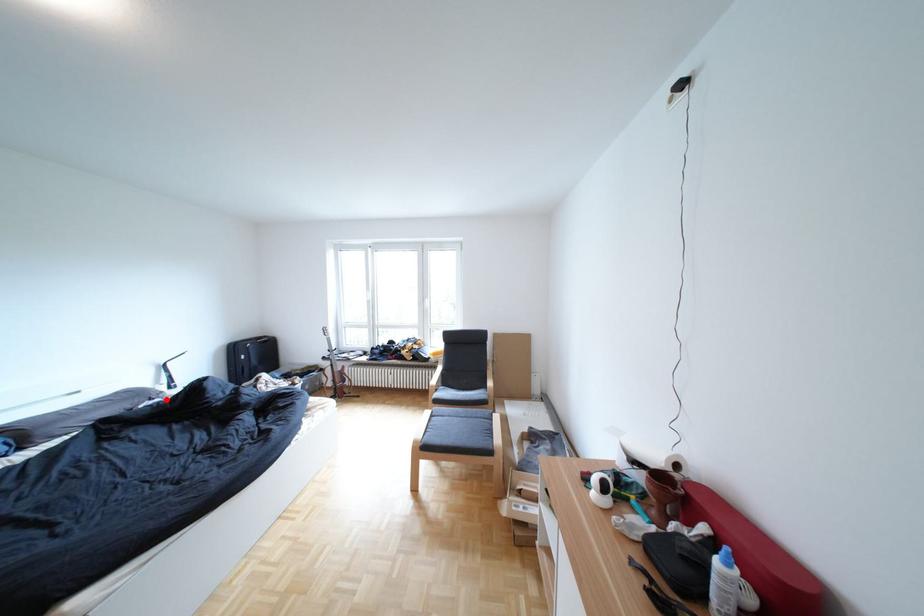
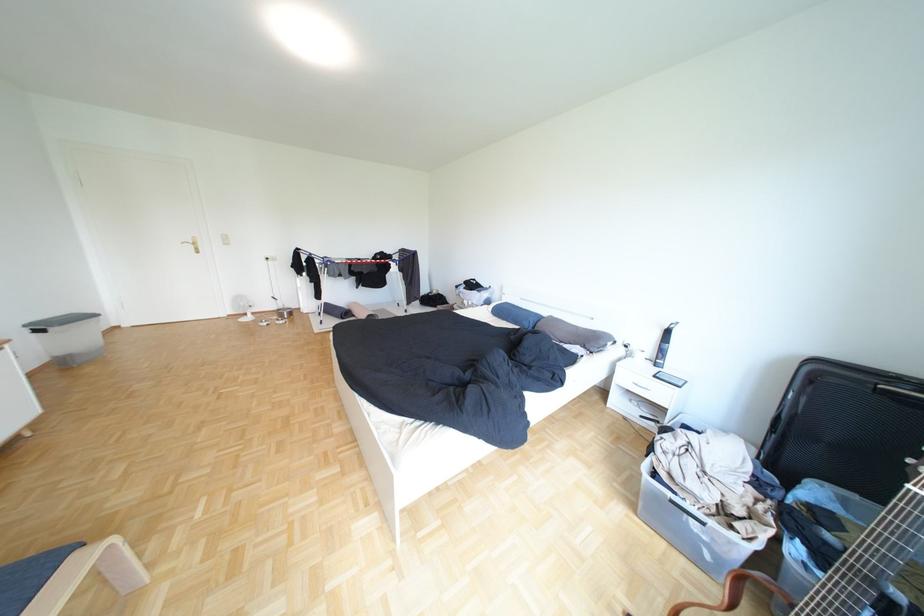
The point at the highlighted location is marked in the first image. Where is the corresponding point in the second image?

(600, 347)